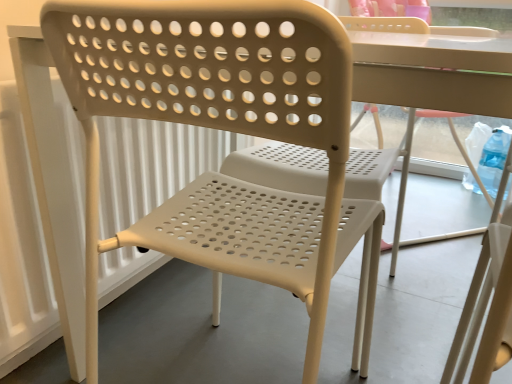
Measure the distance between point [379,65] and camera.

They are 18.43 inches apart.

Describe the element at coordinates (430, 107) in the screenshot. I see `beige perforated chair at center, the second chair in the front-to-back sequence` at that location.

This screenshot has width=512, height=384. Find the location of `beige perforated chair at center, the 1th chair when ordered from right to left`. beige perforated chair at center, the 1th chair when ordered from right to left is located at coordinates (430, 107).

Describe the element at coordinates (228, 130) in the screenshot. I see `beige perforated plastic chair at center, arranged as the 2th chair when viewed from the right` at that location.

The image size is (512, 384). In order to click on beige perforated plastic chair at center, which is the 2th chair in back-to-front order in this screenshot , I will do `click(228, 130)`.

In order to face beige perforated plastic chair at center, arranged as the 2th chair when viewed from the right, should I rotate leftwards or rightwards?

Rotate your view left by about 1.192°.

Consider the image. What is the approximate width of beige perforated plastic chair at center, which is the first chair from front to back?

beige perforated plastic chair at center, which is the first chair from front to back, is 20.43 inches wide.

The image size is (512, 384). In order to click on beige perforated chair at center, the second chair in the front-to-back sequence in this screenshot , I will do `click(430, 107)`.

Considering the relative positions of beige perforated plastic chair at center, which is the 2th chair in back-to-front order, and beige perforated chair at center, placed as the first chair when sorted from back to front, in the image provided, is beige perforated plastic chair at center, which is the 2th chair in back-to-front order, to the left of beige perforated chair at center, placed as the first chair when sorted from back to front, from the viewer's perspective?

Yes, beige perforated plastic chair at center, which is the 2th chair in back-to-front order, is to the left of beige perforated chair at center, placed as the first chair when sorted from back to front.

Considering the positions of objects beige perforated plastic chair at center, which is the first chair from front to back, and beige perforated chair at center, the second chair in the front-to-back sequence, in the image provided, who is behind, beige perforated plastic chair at center, which is the first chair from front to back, or beige perforated chair at center, the second chair in the front-to-back sequence,?

beige perforated chair at center, the second chair in the front-to-back sequence, is further away from the camera.

Which is in front, point (237, 241) or point (504, 102)?

The point (504, 102) is closer.

From the picture: From the image's perspective, does beige perforated plastic chair at center, arranged as the 2th chair when viewed from the right, appear higher than beige perforated chair at center, which ranks as the 2th chair in left-to-right order?

No, from the image's perspective, beige perforated plastic chair at center, arranged as the 2th chair when viewed from the right, is not above beige perforated chair at center, which ranks as the 2th chair in left-to-right order.

From a real-world perspective, which object stands above the other?

beige perforated chair at center, the 1th chair when ordered from right to left, is physically above.

Considering the sizes of objects beige perforated plastic chair at center, arranged as the 2th chair when viewed from the right, and beige perforated chair at center, placed as the first chair when sorted from back to front, in the image provided, who is wider, beige perforated plastic chair at center, arranged as the 2th chair when viewed from the right, or beige perforated chair at center, placed as the first chair when sorted from back to front,?

beige perforated chair at center, placed as the first chair when sorted from back to front, is wider.

From their relative heights in the image, would you say beige perforated plastic chair at center, arranged as the 2th chair when viewed from the right, is taller or shorter than beige perforated chair at center, the second chair in the front-to-back sequence?

Clearly, beige perforated plastic chair at center, arranged as the 2th chair when viewed from the right, is shorter compared to beige perforated chair at center, the second chair in the front-to-back sequence.

Looking at the image, does beige perforated plastic chair at center, placed as the 1th chair when sorted from left to right, seem bigger or smaller compared to beige perforated chair at center, the 1th chair when ordered from right to left?

Considering their sizes, beige perforated plastic chair at center, placed as the 1th chair when sorted from left to right, takes up less space than beige perforated chair at center, the 1th chair when ordered from right to left.

Is beige perforated chair at center, the 1th chair when ordered from right to left, located within beige perforated plastic chair at center, arranged as the 2th chair when viewed from the right?

Definitely not — beige perforated chair at center, the 1th chair when ordered from right to left, is not inside beige perforated plastic chair at center, arranged as the 2th chair when viewed from the right.

Is beige perforated plastic chair at center, which is the first chair from front to back, not close to beige perforated chair at center, which ranks as the 2th chair in left-to-right order?

No, there isn't a large distance between beige perforated plastic chair at center, which is the first chair from front to back, and beige perforated chair at center, which ranks as the 2th chair in left-to-right order.

Is beige perforated plastic chair at center, arranged as the 2th chair when viewed from the right, facing towards beige perforated chair at center, the second chair in the front-to-back sequence?

Yes, beige perforated plastic chair at center, arranged as the 2th chair when viewed from the right, faces towards beige perforated chair at center, the second chair in the front-to-back sequence.

Where is `chair that is above the beige perforated plastic chair at center, which is the first chair from front to back (from the image's perspective)`? This screenshot has height=384, width=512. chair that is above the beige perforated plastic chair at center, which is the first chair from front to back (from the image's perspective) is located at coordinates (430, 107).

In the image, is beige perforated chair at center, which ranks as the 2th chair in left-to-right order, on the left side or the right side of beige perforated plastic chair at center, which is the first chair from front to back?

beige perforated chair at center, which ranks as the 2th chair in left-to-right order, is positioned on beige perforated plastic chair at center, which is the first chair from front to back,'s right side.

Between beige perforated chair at center, placed as the first chair when sorted from back to front, and beige perforated plastic chair at center, placed as the 1th chair when sorted from left to right, which one is positioned in front?

beige perforated plastic chair at center, placed as the 1th chair when sorted from left to right, is closer to the camera.

Does point (410, 98) appear closer or farther from the camera than point (360, 370)?

Point (410, 98).

From the picture: From the image's perspective, which object appears higher, beige perforated chair at center, the 1th chair when ordered from right to left, or beige perforated plastic chair at center, which is the first chair from front to back?

From the image's view, beige perforated chair at center, the 1th chair when ordered from right to left, is above.

From a real-world perspective, does beige perforated chair at center, which ranks as the 2th chair in left-to-right order, sit lower than beige perforated plastic chair at center, which is the first chair from front to back?

No, from a real-world perspective, beige perforated chair at center, which ranks as the 2th chair in left-to-right order, is not below beige perforated plastic chair at center, which is the first chair from front to back.

Can you confirm if beige perforated chair at center, the 1th chair when ordered from right to left, is thinner than beige perforated plastic chair at center, which is the first chair from front to back?

No.

Which of these two, beige perforated chair at center, placed as the first chair when sorted from back to front, or beige perforated plastic chair at center, arranged as the 2th chair when viewed from the right, stands shorter?

Standing shorter between the two is beige perforated plastic chair at center, arranged as the 2th chair when viewed from the right.

Does beige perforated chair at center, the second chair in the front-to-back sequence, have a smaller size compared to beige perforated plastic chair at center, arranged as the 2th chair when viewed from the right?

No.

Choose the correct answer: Is beige perforated chair at center, placed as the first chair when sorted from back to front, inside beige perforated plastic chair at center, placed as the 1th chair when sorted from left to right, or outside it?

beige perforated chair at center, placed as the first chair when sorted from back to front, is spatially situated outside beige perforated plastic chair at center, placed as the 1th chair when sorted from left to right.

Is beige perforated chair at center, the second chair in the front-to-back sequence, touching beige perforated plastic chair at center, arranged as the 2th chair when viewed from the right?

No, beige perforated chair at center, the second chair in the front-to-back sequence, is not with beige perforated plastic chair at center, arranged as the 2th chair when viewed from the right.

Is beige perforated plastic chair at center, which is the first chair from front to back, at the back of beige perforated chair at center, which ranks as the 2th chair in left-to-right order?

That's not correct — beige perforated chair at center, which ranks as the 2th chair in left-to-right order, is not looking away from beige perforated plastic chair at center, which is the first chair from front to back.

What's the angular difference between beige perforated chair at center, which ranks as the 2th chair in left-to-right order, and beige perforated plastic chair at center, placed as the 1th chair when sorted from left to right,'s facing directions?

The angle between the facing direction of beige perforated chair at center, which ranks as the 2th chair in left-to-right order, and the facing direction of beige perforated plastic chair at center, placed as the 1th chair when sorted from left to right, is 132 degrees.

Could you measure the distance between beige perforated chair at center, placed as the first chair when sorted from back to front, and beige perforated plastic chair at center, which is the 2th chair in back-to-front order?

A distance of 84.89 centimeters exists between beige perforated chair at center, placed as the first chair when sorted from back to front, and beige perforated plastic chair at center, which is the 2th chair in back-to-front order.

Locate an element on the screen. The width and height of the screenshot is (512, 384). chair on the right of the beige perforated plastic chair at center, which is the first chair from front to back is located at coordinates (430, 107).

Locate an element on the screen. The height and width of the screenshot is (384, 512). chair on the left side of beige perforated chair at center, the 1th chair when ordered from right to left is located at coordinates (228, 130).

This screenshot has width=512, height=384. In order to click on chair in front of the beige perforated chair at center, the second chair in the front-to-back sequence in this screenshot , I will do `click(228, 130)`.